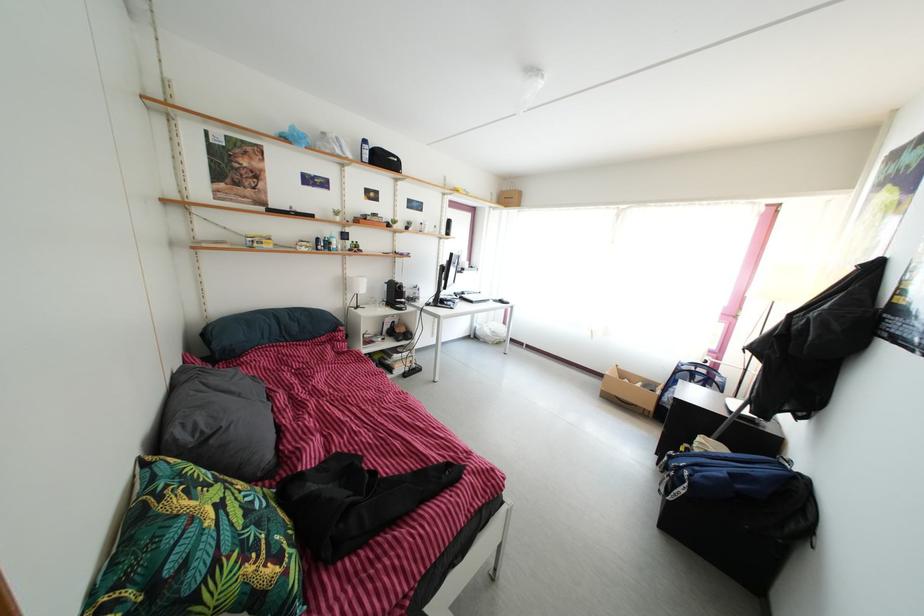
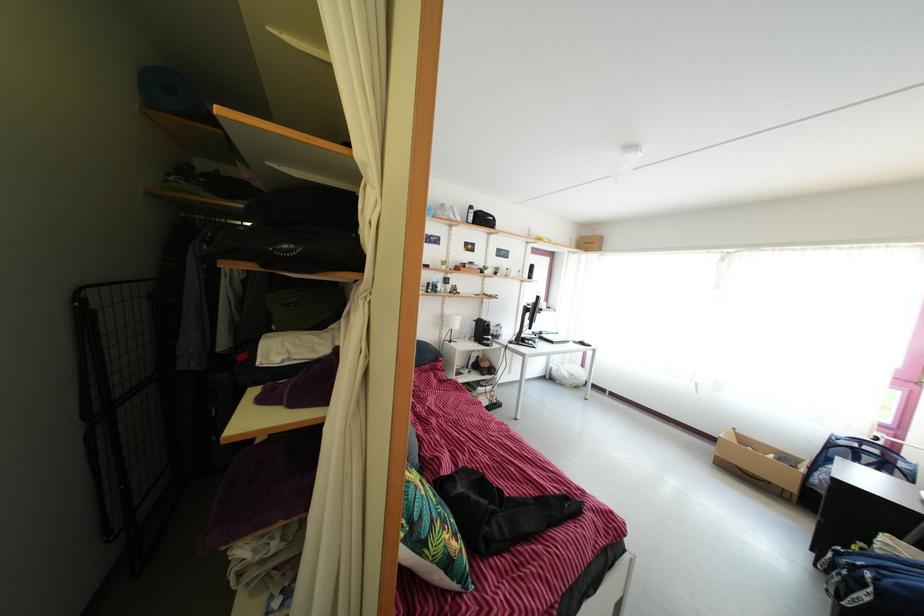
In the second image, find the point that corresponds to (402,302) in the first image.

(489, 339)